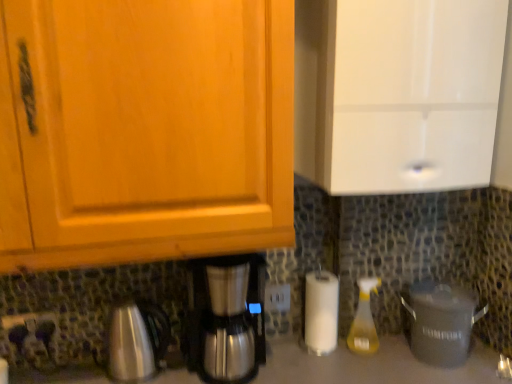
Where is `gray matte crock pot at lower right`? Image resolution: width=512 pixels, height=384 pixels. gray matte crock pot at lower right is located at coordinates (441, 322).

This screenshot has width=512, height=384. What are the coordinates of `metallic silver power plugs and sockets at lower left, the 1th power plugs and sockets in the front-to-back sequence` in the screenshot? It's located at (30, 330).

What do you see at coordinates (225, 319) in the screenshot? Image resolution: width=512 pixels, height=384 pixels. I see `satin silver coffee maker at lower center` at bounding box center [225, 319].

This screenshot has width=512, height=384. Find the location of `satin silver coffee maker at lower center`. satin silver coffee maker at lower center is located at coordinates (225, 319).

What is the approximate width of matte black outlet at lower center?

matte black outlet at lower center is 1.22 inches wide.

Locate an element on the screen. This screenshot has width=512, height=384. white matte paper towel at center is located at coordinates (321, 312).

Locate an element on the screen. This screenshot has height=384, width=512. gray matte crock pot at lower right is located at coordinates (441, 322).

Can you confirm if white glossy cabinet at upper right is thinner than satin silver coffee pot at lower left?

No, white glossy cabinet at upper right is not thinner than satin silver coffee pot at lower left.

Does point (371, 72) come farther from viewer compared to point (125, 354)?

No.

Would you say white glossy cabinet at upper right is inside or outside satin silver coffee pot at lower left?

white glossy cabinet at upper right is not enclosed by satin silver coffee pot at lower left.

From a real-world perspective, is matte black outlet at lower center under satin silver coffee maker at lower center?

Indeed, from a real-world perspective, matte black outlet at lower center is positioned beneath satin silver coffee maker at lower center.

Is matte black outlet at lower center smaller than satin silver coffee maker at lower center?

Yes, matte black outlet at lower center is smaller than satin silver coffee maker at lower center.

Is satin silver coffee maker at lower center surrounded by matte black outlet at lower center?

No.

From a real-world perspective, is gray matte crock pot at lower right on top of white matte paper towel at center?

Answer: No.

Considering the sizes of objects gray matte crock pot at lower right and white matte paper towel at center in the image provided, who is thinner, gray matte crock pot at lower right or white matte paper towel at center?

white matte paper towel at center.

From the image's perspective, between gray matte crock pot at lower right and white matte paper towel at center, which one is located above?

white matte paper towel at center.

Is gray matte crock pot at lower right next to white matte paper towel at center?

There is a gap between gray matte crock pot at lower right and white matte paper towel at center.

What's the angular difference between white plastic power plugs and sockets at center, which ranks as the 2th power plugs and sockets in front-to-back order, and matte black outlet at lower center's facing directions?

The angular difference between white plastic power plugs and sockets at center, which ranks as the 2th power plugs and sockets in front-to-back order, and matte black outlet at lower center is 0.0241 degrees.

Locate an element on the screen. This screenshot has height=384, width=512. the 2nd power plugs and sockets above the matte black outlet at lower center (from a real-world perspective) is located at coordinates (277, 298).

Is white plastic power plugs and sockets at center, positioned as the second power plugs and sockets in left-to-right order, wider or thinner than matte black outlet at lower center?

In the image, white plastic power plugs and sockets at center, positioned as the second power plugs and sockets in left-to-right order, appears to be more narrow than matte black outlet at lower center.

Considering the positions of objects white plastic power plugs and sockets at center, placed as the 1th power plugs and sockets when sorted from back to front, and matte black outlet at lower center in the image provided, who is more to the right, white plastic power plugs and sockets at center, placed as the 1th power plugs and sockets when sorted from back to front, or matte black outlet at lower center?

Positioned to the right is white plastic power plugs and sockets at center, placed as the 1th power plugs and sockets when sorted from back to front.

From the image's perspective, which is below, white plastic power plugs and sockets at center, acting as the 1th power plugs and sockets starting from the right, or metallic silver power plugs and sockets at lower left, the 2th power plugs and sockets viewed from the right?

metallic silver power plugs and sockets at lower left, the 2th power plugs and sockets viewed from the right, appears lower in the image.

Measure the distance between white plastic power plugs and sockets at center, which ranks as the 2th power plugs and sockets in front-to-back order, and metallic silver power plugs and sockets at lower left, the 1th power plugs and sockets in the front-to-back sequence.

white plastic power plugs and sockets at center, which ranks as the 2th power plugs and sockets in front-to-back order, is 28.56 inches away from metallic silver power plugs and sockets at lower left, the 1th power plugs and sockets in the front-to-back sequence.

Between white plastic power plugs and sockets at center, positioned as the second power plugs and sockets in left-to-right order, and metallic silver power plugs and sockets at lower left, marked as the second power plugs and sockets in a back-to-front arrangement, which one has less height?

white plastic power plugs and sockets at center, positioned as the second power plugs and sockets in left-to-right order.

Locate an element on the screen. power plugs and sockets below the white plastic power plugs and sockets at center, acting as the 1th power plugs and sockets starting from the right (from a real-world perspective) is located at coordinates (30, 330).

Based on the photo, from a real-world perspective, is white matte paper towel at center beneath satin silver coffee maker at lower center?

Yes, from a real-world perspective, white matte paper towel at center is beneath satin silver coffee maker at lower center.

Is white matte paper towel at center not within satin silver coffee maker at lower center?

white matte paper towel at center is positioned outside satin silver coffee maker at lower center.

Which is more to the right, white matte paper towel at center or satin silver coffee maker at lower center?

From the viewer's perspective, white matte paper towel at center appears more on the right side.

From a real-world perspective, relative to metallic silver power plugs and sockets at lower left, the 1th power plugs and sockets in the front-to-back sequence, is satin silver coffee pot at lower left vertically above or below?

In terms of real-world spatial position, satin silver coffee pot at lower left is below metallic silver power plugs and sockets at lower left, the 1th power plugs and sockets in the front-to-back sequence.

The image size is (512, 384). What are the coordinates of `coffeepot that appears in front of the metallic silver power plugs and sockets at lower left, marked as the second power plugs and sockets in a back-to-front arrangement` in the screenshot? It's located at (136, 340).

Between satin silver coffee pot at lower left and metallic silver power plugs and sockets at lower left, the 1th power plugs and sockets in the front-to-back sequence, which one has larger width?

satin silver coffee pot at lower left is wider.

Is point (154, 321) closer to viewer compared to point (11, 337)?

No, (154, 321) is behind (11, 337).

Identify the location of cabinetry lying on the right of satin silver coffee pot at lower left. This screenshot has width=512, height=384. (397, 93).

The height and width of the screenshot is (384, 512). Find the location of `coffee maker that is in front of the matte black outlet at lower center`. coffee maker that is in front of the matte black outlet at lower center is located at coordinates (225, 319).

From the picture: When comparing their distances from satin silver coffee maker at lower center, does white plastic power plugs and sockets at center, placed as the 1th power plugs and sockets when sorted from back to front, or white matte paper towel at center seem closer?

Among the two, white plastic power plugs and sockets at center, placed as the 1th power plugs and sockets when sorted from back to front, is located nearer to satin silver coffee maker at lower center.

Considering their positions, is white matte paper towel at center positioned closer to white plastic power plugs and sockets at center, which ranks as the 2th power plugs and sockets in front-to-back order, than metallic silver power plugs and sockets at lower left, the 2th power plugs and sockets viewed from the right?

white matte paper towel at center.

Looking at this image, which object lies nearer to the anchor point white plastic power plugs and sockets at center, positioned as the second power plugs and sockets in left-to-right order, white glossy cabinet at upper right or satin silver coffee maker at lower center?

The object closer to white plastic power plugs and sockets at center, positioned as the second power plugs and sockets in left-to-right order, is satin silver coffee maker at lower center.

Which object lies further to the anchor point gray matte crock pot at lower right, white plastic power plugs and sockets at center, placed as the 1th power plugs and sockets when sorted from back to front, or satin silver coffee pot at lower left?

satin silver coffee pot at lower left is further to gray matte crock pot at lower right.

Estimate the real-world distances between objects in this image. Which object is closer to metallic silver power plugs and sockets at lower left, marked as the second power plugs and sockets in a back-to-front arrangement, white plastic power plugs and sockets at center, placed as the 1th power plugs and sockets when sorted from back to front, or satin silver coffee pot at lower left?

Among the two, satin silver coffee pot at lower left is located nearer to metallic silver power plugs and sockets at lower left, marked as the second power plugs and sockets in a back-to-front arrangement.

Considering their positions, is yellow translucent spray bottle at lower right positioned further to white matte paper towel at center than metallic silver power plugs and sockets at lower left, marked as the second power plugs and sockets in a back-to-front arrangement?

The object further to white matte paper towel at center is metallic silver power plugs and sockets at lower left, marked as the second power plugs and sockets in a back-to-front arrangement.

Looking at this image, based on their spatial positions, is yellow translucent spray bottle at lower right or matte black outlet at lower center closer to metallic silver power plugs and sockets at lower left, the 1th power plugs and sockets in the front-to-back sequence?

Among the two, matte black outlet at lower center is located nearer to metallic silver power plugs and sockets at lower left, the 1th power plugs and sockets in the front-to-back sequence.

Which object lies further to the anchor point metallic silver power plugs and sockets at lower left, marked as the second power plugs and sockets in a back-to-front arrangement, satin silver coffee pot at lower left or gray matte crock pot at lower right?

gray matte crock pot at lower right is positioned further to the anchor metallic silver power plugs and sockets at lower left, marked as the second power plugs and sockets in a back-to-front arrangement.

Find the location of a particular element. coffee maker located between satin silver coffee pot at lower left and yellow translucent spray bottle at lower right in the left-right direction is located at coordinates (225, 319).

This screenshot has height=384, width=512. I want to click on power plugs and sockets between metallic silver power plugs and sockets at lower left, marked as the second power plugs and sockets in a back-to-front arrangement, and gray matte crock pot at lower right, in the horizontal direction, so [x=277, y=298].

Find the location of a particular element. The image size is (512, 384). power plugs and sockets between metallic silver power plugs and sockets at lower left, the 2th power plugs and sockets viewed from the right, and yellow translucent spray bottle at lower right, in the horizontal direction is located at coordinates (277, 298).

You are a GUI agent. You are given a task and a screenshot of the screen. Output one action in this format:
    pyautogui.click(x=<x>, y=<y>)
    Task: Click on the coffeepot situated between matte black outlet at lower center and white matte paper towel at center from left to right
    The image size is (512, 384).
    Given the screenshot: What is the action you would take?
    pyautogui.click(x=136, y=340)